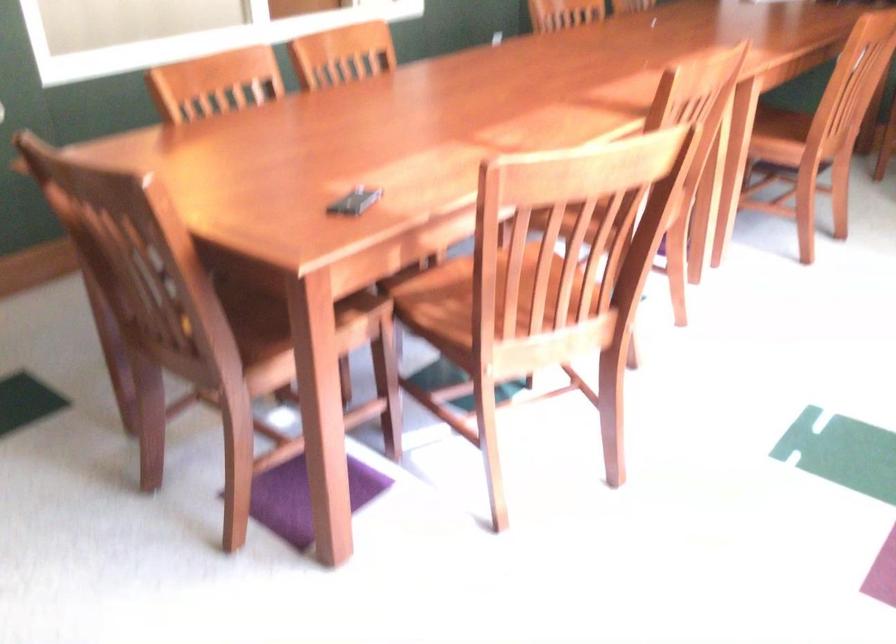
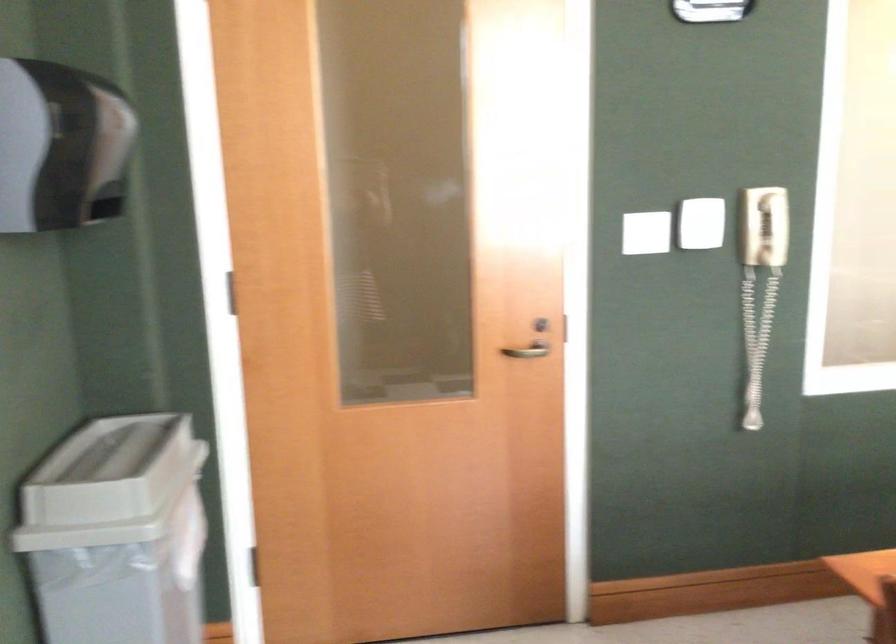
Question: How did the camera likely rotate?

Choices:
 (A) Left
 (B) Right
 (C) Up
 (D) Down

Answer: (A)